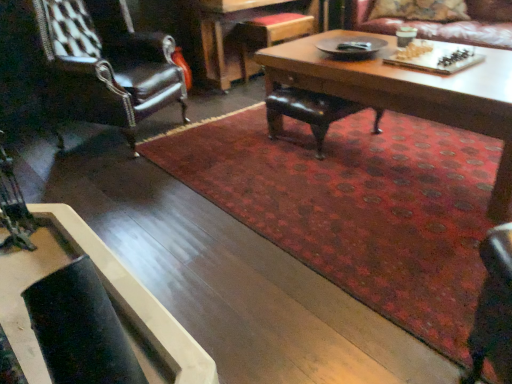
Question: Considering the relative sizes of velvet floral pillow at upper right and leather armchair at left, which ranks as the 1th chair in left-to-right order, in the image provided, is velvet floral pillow at upper right wider than leather armchair at left, which ranks as the 1th chair in left-to-right order,?

Choices:
 (A) yes
 (B) no

Answer: (B)

Question: Is velvet floral pillow at upper right oriented away from leather armchair at left, which ranks as the 1th chair in left-to-right order?

Choices:
 (A) yes
 (B) no

Answer: (B)

Question: From a real-world perspective, is velvet floral pillow at upper right positioned over leather armchair at left, which ranks as the 1th chair in left-to-right order, based on gravity?

Choices:
 (A) yes
 (B) no

Answer: (A)

Question: Considering the relative positions of velvet floral pillow at upper right and leather armchair at left, acting as the second chair starting from the right, in the image provided, is velvet floral pillow at upper right behind leather armchair at left, acting as the second chair starting from the right,?

Choices:
 (A) no
 (B) yes

Answer: (B)

Question: Does velvet floral pillow at upper right have a smaller size compared to leather armchair at left, acting as the second chair starting from the right?

Choices:
 (A) no
 (B) yes

Answer: (B)

Question: Is velvet floral pillow at upper right taller or shorter than wooden coffee table at center, which appears as the first coffee table when viewed from the back?

Choices:
 (A) short
 (B) tall

Answer: (A)

Question: Considering the positions of velvet floral pillow at upper right and wooden coffee table at center, arranged as the 1th coffee table when viewed from the top, in the image, is velvet floral pillow at upper right bigger or smaller than wooden coffee table at center, arranged as the 1th coffee table when viewed from the top,?

Choices:
 (A) big
 (B) small

Answer: (B)

Question: Relative to wooden coffee table at center, placed as the 2th coffee table when sorted from bottom to top, is velvet floral pillow at upper right in front or behind?

Choices:
 (A) front
 (B) behind

Answer: (B)

Question: Is velvet floral pillow at upper right wider or thinner than wooden coffee table at center, arranged as the 1th coffee table when viewed from the top?

Choices:
 (A) thin
 (B) wide

Answer: (A)

Question: Based on their positions, is velvet floral pillow at upper right located to the left or right of leather armchair at left, which ranks as the 1th chair in left-to-right order?

Choices:
 (A) left
 (B) right

Answer: (B)

Question: From the image's perspective, is velvet floral pillow at upper right above or below leather armchair at left, acting as the second chair starting from the right?

Choices:
 (A) above
 (B) below

Answer: (A)

Question: Is velvet floral pillow at upper right in front of or behind leather armchair at left, acting as the second chair starting from the right, in the image?

Choices:
 (A) behind
 (B) front

Answer: (A)

Question: Is point (444, 16) positioned closer to the camera than point (173, 89)?

Choices:
 (A) farther
 (B) closer

Answer: (A)

Question: In terms of size, does leather armchair at left, acting as the second chair starting from the right, appear bigger or smaller than leather at center, which is the first chair in right-to-left order?

Choices:
 (A) big
 (B) small

Answer: (A)

Question: Looking at their shapes, would you say leather armchair at left, acting as the second chair starting from the right, is wider or thinner than leather at center, which is the second chair in left-to-right order?

Choices:
 (A) wide
 (B) thin

Answer: (A)